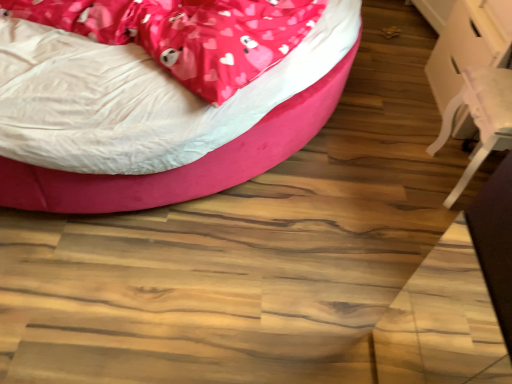
Question: Could you tell me if velvet pink bed at upper left is facing white glossy table at right?

Choices:
 (A) yes
 (B) no

Answer: (A)

Question: Is velvet pink bed at upper left taller than white glossy table at right?

Choices:
 (A) yes
 (B) no

Answer: (B)

Question: Is the position of velvet pink bed at upper left more distant than that of white glossy table at right?

Choices:
 (A) no
 (B) yes

Answer: (A)

Question: Is velvet pink bed at upper left positioned before white glossy table at right?

Choices:
 (A) no
 (B) yes

Answer: (B)

Question: Is velvet pink bed at upper left touching white glossy table at right?

Choices:
 (A) yes
 (B) no

Answer: (B)

Question: Considering the relative positions of velvet pink bed at upper left and white glossy table at right in the image provided, is velvet pink bed at upper left to the left of white glossy table at right from the viewer's perspective?

Choices:
 (A) yes
 (B) no

Answer: (A)

Question: Is velvet pink bed at upper left thinner than pink satin blanket at upper left?

Choices:
 (A) no
 (B) yes

Answer: (A)

Question: Does velvet pink bed at upper left appear on the left side of pink satin blanket at upper left?

Choices:
 (A) no
 (B) yes

Answer: (B)

Question: Is pink satin blanket at upper left at the back of velvet pink bed at upper left?

Choices:
 (A) no
 (B) yes

Answer: (A)

Question: Does velvet pink bed at upper left appear on the right side of pink satin blanket at upper left?

Choices:
 (A) yes
 (B) no

Answer: (B)

Question: From a real-world perspective, is velvet pink bed at upper left located beneath pink satin blanket at upper left?

Choices:
 (A) yes
 (B) no

Answer: (A)

Question: Is velvet pink bed at upper left facing towards pink satin blanket at upper left?

Choices:
 (A) yes
 (B) no

Answer: (B)

Question: Does pink satin blanket at upper left turn towards white plastic swivel chair at right?

Choices:
 (A) no
 (B) yes

Answer: (A)